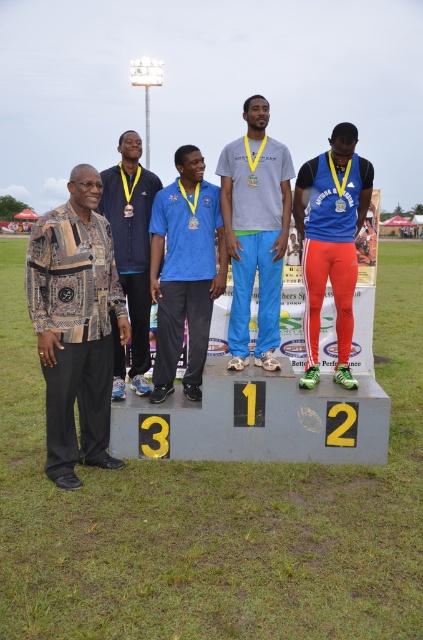
Question: Which point is closer to the camera taking this photo?

Choices:
 (A) (47, 410)
 (B) (335, 131)

Answer: (A)

Question: Which point is closer to the camera?

Choices:
 (A) navy blue jacket at left
 (B) patterned fabric jacket at left

Answer: (B)

Question: In this image, where is matte blue shirt at center located relative to navy blue jacket at left?

Choices:
 (A) below
 (B) above

Answer: (A)

Question: Does patterned fabric jacket at left appear on the right side of navy blue jacket at left?

Choices:
 (A) no
 (B) yes

Answer: (A)

Question: Is blue synthetic track suit at center positioned behind navy blue jacket at left?

Choices:
 (A) yes
 (B) no

Answer: (A)

Question: Which object is positioned farthest from the patterned fabric jacket at left?

Choices:
 (A) gray matte t-shirt at center
 (B) navy blue jacket at left
 (C) matte blue shirt at center
 (D) blue synthetic track suit at center

Answer: (D)